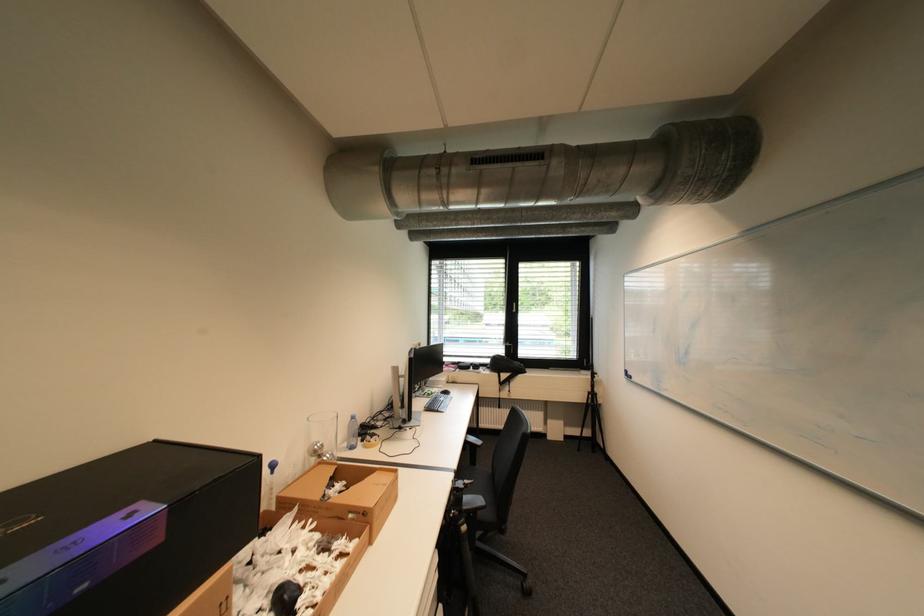
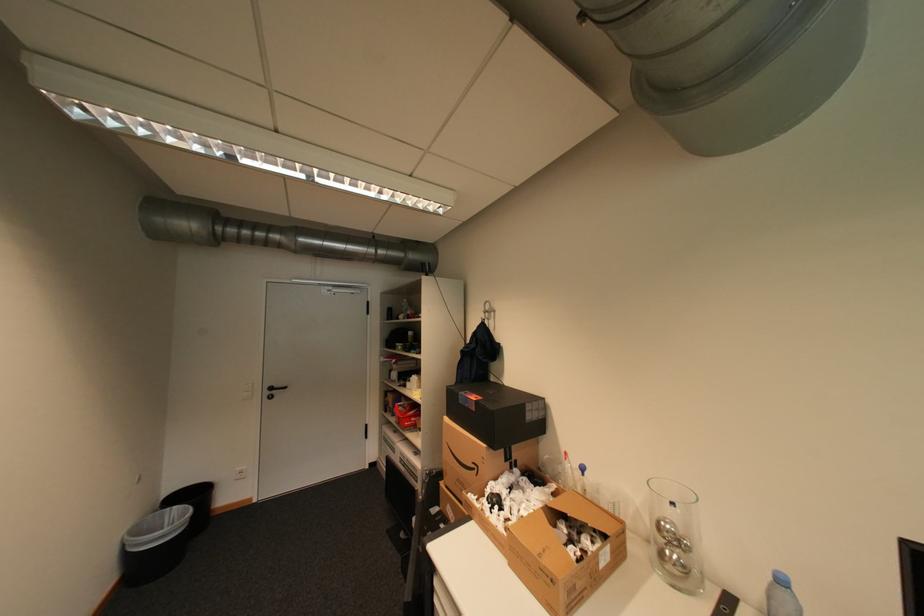
Locate, in the second image, the point that corresponds to point (91, 586) in the first image.

(476, 406)